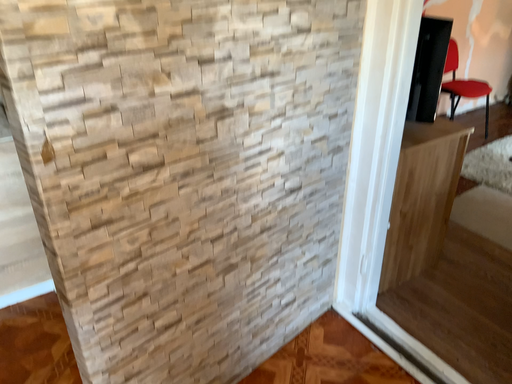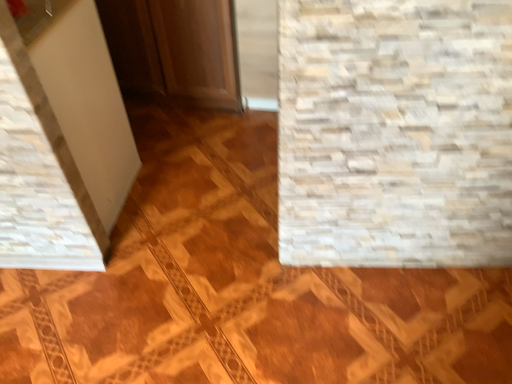
Question: How did the camera likely rotate when shooting the video?

Choices:
 (A) rotated right
 (B) rotated left

Answer: (B)